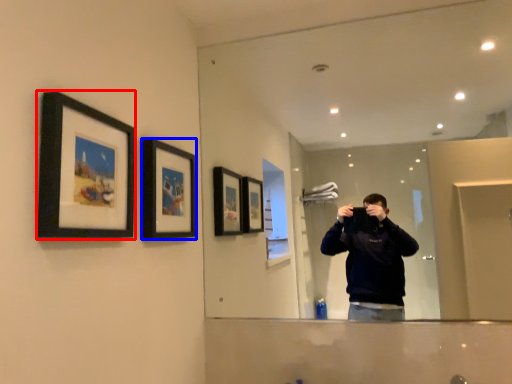
Question: Among these objects, which one is nearest to the camera, picture frame (highlighted by a red box) or picture frame (highlighted by a blue box)?

Choices:
 (A) picture frame
 (B) picture frame

Answer: (A)